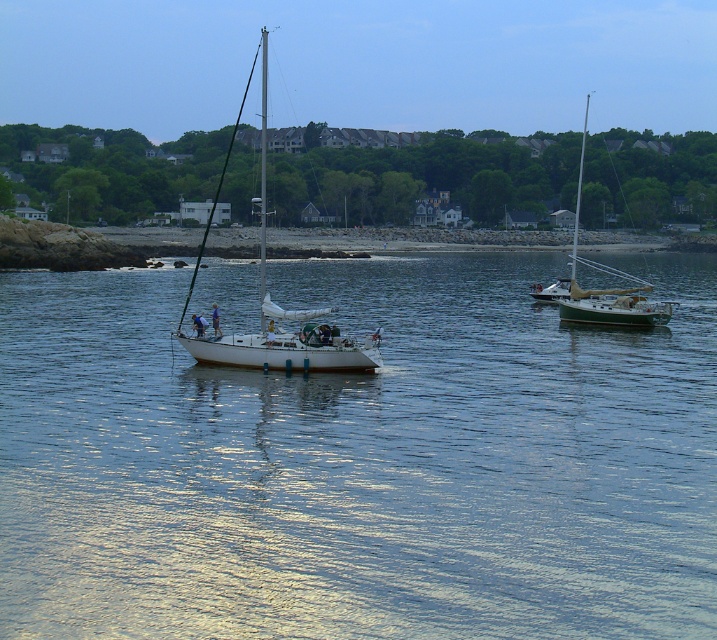
Is smooth sand shoreline at center behind white glossy sailboat at right?

Yes, it is.

You are a GUI agent. You are given a task and a screenshot of the screen. Output one action in this format:
    pyautogui.click(x=<x>, y=<y>)
    Task: Click on the smooth sand shoreline at center
    This screenshot has height=640, width=717.
    Given the screenshot: What is the action you would take?
    pyautogui.click(x=404, y=241)

This screenshot has height=640, width=717. Find the location of `smooth sand shoreline at center`. smooth sand shoreline at center is located at coordinates (404, 241).

Looking at this image, can you confirm if clear blue water at center is thinner than smooth sand shoreline at center?

Correct, clear blue water at center's width is less than smooth sand shoreline at center's.

Does clear blue water at center have a greater height compared to smooth sand shoreline at center?

Indeed, clear blue water at center has a greater height compared to smooth sand shoreline at center.

The width and height of the screenshot is (717, 640). Find the location of `clear blue water at center`. clear blue water at center is located at coordinates (358, 461).

Is the position of clear blue water at center more distant than that of white glossy sailboat at right?

That is False.

Measure the distance between clear blue water at center and camera.

clear blue water at center is 33.70 feet away from camera.

Which is in front, point (285, 285) or point (665, 301)?

Point (665, 301) is in front.

Locate an element on the screen. This screenshot has height=640, width=717. clear blue water at center is located at coordinates (358, 461).